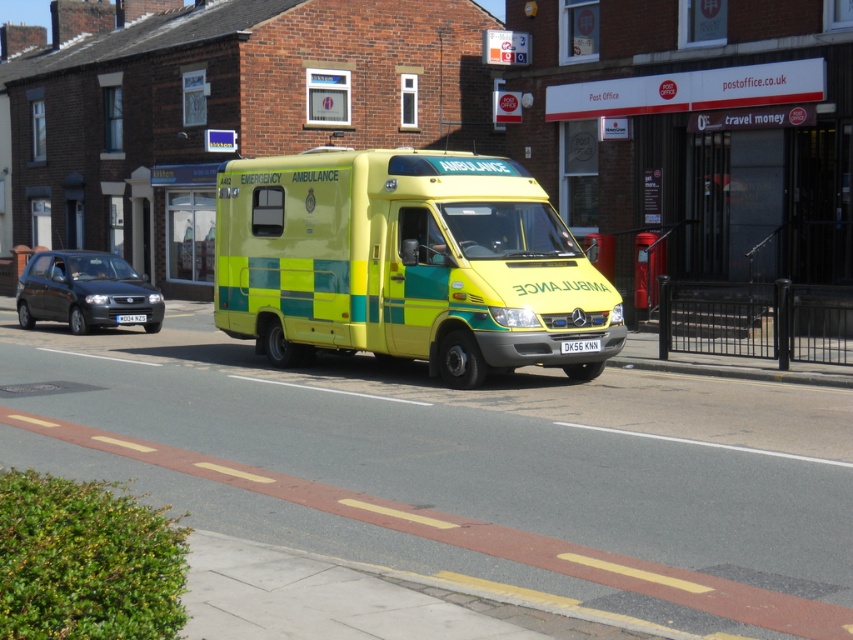
Can you confirm if matte black car at left is positioned to the left of white plastic license plate at center?

Correct, you'll find matte black car at left to the left of white plastic license plate at center.

Who is positioned more to the right, matte black car at left or white plastic license plate at center?

From the viewer's perspective, white plastic license plate at center appears more on the right side.

This screenshot has height=640, width=853. Find the location of `matte black car at left`. matte black car at left is located at coordinates (83, 291).

The width and height of the screenshot is (853, 640). I want to click on matte black car at left, so click(83, 291).

This screenshot has width=853, height=640. What are the coordinates of `yellow/green checkered ambulance at center` in the screenshot? It's located at (405, 262).

Is point (515, 365) in front of point (131, 317)?

Yes, it is in front of point (131, 317).

Identify the location of yellow/green checkered ambulance at center. This screenshot has height=640, width=853. (405, 262).

Between point (230, 300) and point (579, 344), which one is positioned in front?

Positioned in front is point (579, 344).

Who is taller, yellow/green checkered ambulance at center or black plastic license plate at center?

yellow/green checkered ambulance at center

The height and width of the screenshot is (640, 853). I want to click on yellow/green checkered ambulance at center, so click(x=405, y=262).

Locate an element on the screen. This screenshot has height=640, width=853. yellow/green checkered ambulance at center is located at coordinates (405, 262).